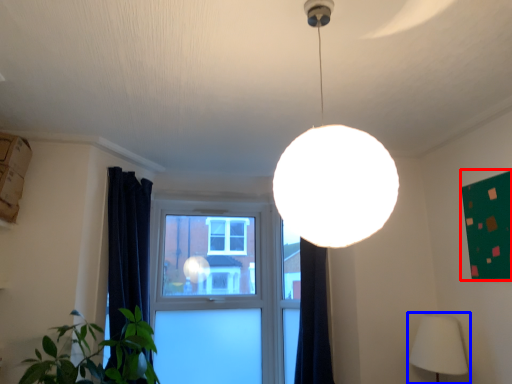
Question: Among these objects, which one is farthest to the camera, bulletin board (highlighted by a red box) or lamp (highlighted by a blue box)?

Choices:
 (A) bulletin board
 (B) lamp

Answer: (B)